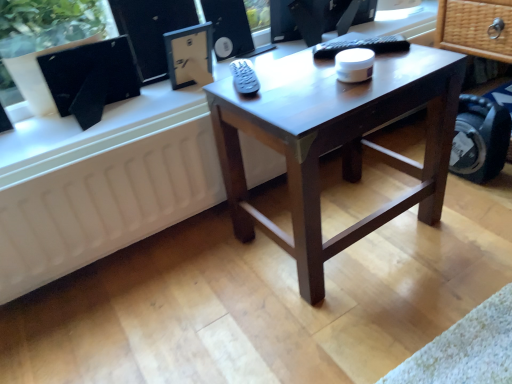
I want to click on vacant point to the right of matte dark brown coffee table at center, so click(x=455, y=221).